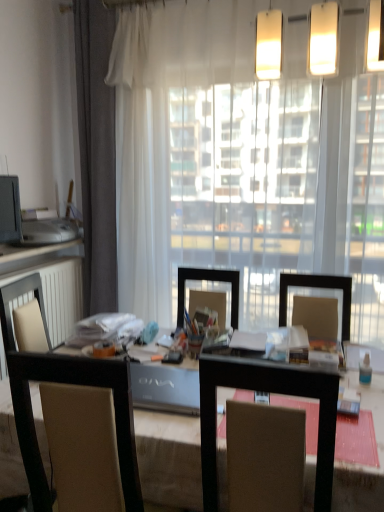
This screenshot has width=384, height=512. What do you see at coordinates (245, 159) in the screenshot?
I see `transparent curtain at center` at bounding box center [245, 159].

The height and width of the screenshot is (512, 384). What do you see at coordinates (268, 392) in the screenshot?
I see `wooden table at center` at bounding box center [268, 392].

Identify the location of matte black monitor at left. Image resolution: width=384 pixels, height=512 pixels. (10, 210).

Which of these two, matte black monitor at left or white matte radiator at left, is thinner?

Thinner between the two is matte black monitor at left.

Considering the relative positions of matte black monitor at left and white matte radiator at left in the image provided, is matte black monitor at left to the right of white matte radiator at left from the viewer's perspective?

No.

Does matte black monitor at left contain white matte radiator at left?

That's incorrect, white matte radiator at left is not inside matte black monitor at left.

Which object is further away from the camera taking this photo, matte black monitor at left or gray fabric curtain at left?

gray fabric curtain at left is further from the camera.

From a real-world perspective, is matte black monitor at left above or below gray fabric curtain at left?

From a real-world perspective, matte black monitor at left is physically below gray fabric curtain at left.

Between matte black monitor at left and gray fabric curtain at left, which one has smaller width?

With smaller width is matte black monitor at left.

Choose the correct answer: Is matte black monitor at left inside matte white countertop at left or outside it?

matte black monitor at left exists outside the volume of matte white countertop at left.

From a real-world perspective, is matte black monitor at left positioned above or below matte white countertop at left?

matte black monitor at left is situated higher than matte white countertop at left in the real world.

From the image's perspective, is matte black monitor at left on matte white countertop at left?

Yes, from the image's perspective, matte black monitor at left is over matte white countertop at left.

Would you say transparent curtain at center contains wooden table at center?

That's incorrect, wooden table at center is not inside transparent curtain at center.

Between transparent curtain at center and wooden table at center, which one appears on the right side from the viewer's perspective?

transparent curtain at center.

At what (x,y) coordinates should I click in order to perform the action: click on window above the wooden table at center (from the image's perspective). Please return your answer as a coordinate pair (x, y). This screenshot has width=384, height=512. Looking at the image, I should click on (245, 159).

Identify the location of table below the matte black monitor at left (from the image's perspective). (268, 392).

Is matte black monitor at left not inside wooden table at center?

Indeed, matte black monitor at left is completely outside wooden table at center.

From the picture: Who is bigger, matte black monitor at left or wooden table at center?

With larger size is wooden table at center.

From a real-world perspective, is matte black monitor at left over transparent curtain at center?

No, from a real-world perspective, matte black monitor at left is not over transparent curtain at center

From the image's perspective, which is below, matte black monitor at left or transparent curtain at center?

matte black monitor at left is shown below in the image.

Considering the sizes of objects matte black monitor at left and transparent curtain at center in the image provided, who is taller, matte black monitor at left or transparent curtain at center?

transparent curtain at center.

Considering the positions of objects matte black monitor at left and transparent curtain at center in the image provided, who is behind, matte black monitor at left or transparent curtain at center?

transparent curtain at center is further from the camera.

In the scene shown: In terms of width, does white matte radiator at left look wider or thinner when compared to wooden table at center?

white matte radiator at left is thinner than wooden table at center.

Which of these two, white matte radiator at left or wooden table at center, is bigger?

wooden table at center.

From the image's perspective, which is below, white matte radiator at left or wooden table at center?

From the image's view, wooden table at center is below.

Considering the relative positions of white matte radiator at left and wooden table at center in the image provided, is white matte radiator at left to the right of wooden table at center from the viewer's perspective?

No.

Where is `radiator that is below the matte black monitor at left (from the image's perspective)`? Image resolution: width=384 pixels, height=512 pixels. radiator that is below the matte black monitor at left (from the image's perspective) is located at coordinates [x=58, y=295].

The image size is (384, 512). Identify the location of computer monitor below the gray fabric curtain at left (from a real-world perspective). (10, 210).

From the image, which object appears to be farther from white matte radiator at left, wooden table at center or transparent curtain at center?

wooden table at center is positioned further to the anchor white matte radiator at left.

Which object lies further to the anchor point white matte radiator at left, brown fabric chair at center or matte white countertop at left?

Among the two, brown fabric chair at center is located further to white matte radiator at left.

Considering their positions, is brown fabric chair at center positioned closer to transparent curtain at center than white matte radiator at left?

white matte radiator at left.

Based on their spatial positions, is transparent curtain at center or brown fabric chair at center further from wooden table at center?

Based on the image, transparent curtain at center appears to be further to wooden table at center.

When comparing their distances from brown fabric chair at center, does white matte radiator at left or gray fabric curtain at left seem closer?

white matte radiator at left.

Estimate the real-world distances between objects in this image. Which object is closer to gray fabric curtain at left, wooden table at center or transparent curtain at center?

transparent curtain at center is closer to gray fabric curtain at left.

Based on their spatial positions, is brown fabric chair at center or matte white countertop at left closer to gray fabric curtain at left?

matte white countertop at left lies closer to gray fabric curtain at left than the other object.

Looking at this image, estimate the real-world distances between objects in this image. Which object is further from brown fabric chair at center, wooden table at center or transparent curtain at center?

A: Based on the image, transparent curtain at center appears to be further to brown fabric chair at center.

Locate an element on the screen. window between brown fabric chair at center and matte white countertop at left along the z-axis is located at coordinates (245, 159).

This screenshot has width=384, height=512. I want to click on table situated between matte black monitor at left and transparent curtain at center from left to right, so click(x=268, y=392).

This screenshot has width=384, height=512. Find the location of `computer monitor between brown fabric chair at center and gray fabric curtain at left in the front-back direction`. computer monitor between brown fabric chair at center and gray fabric curtain at left in the front-back direction is located at coordinates (10, 210).

At what (x,y) coordinates should I click in order to perform the action: click on chair between wooden table at center and white matte radiator at left in the front-back direction. Please return your answer as a coordinate pair (x, y). The height and width of the screenshot is (512, 384). Looking at the image, I should click on (64, 383).